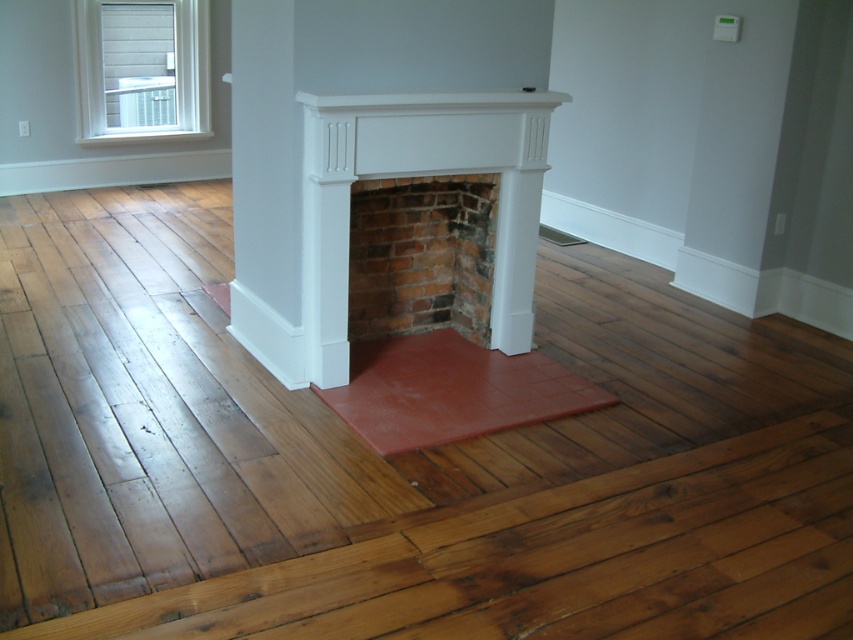
Is white painted brick fireplace at center shorter than brick at center?

No, white painted brick fireplace at center is not shorter than brick at center.

Locate an element on the screen. This screenshot has width=853, height=640. white painted brick fireplace at center is located at coordinates (419, 176).

Can you confirm if shiny brown hardwood floor at center is wider than white matte fireplace mantel at upper center?

Yes, shiny brown hardwood floor at center is wider than white matte fireplace mantel at upper center.

Between point (552, 282) and point (526, 90), which one is positioned in front?

Positioned in front is point (526, 90).

Who is more distant from viewer, (140, 358) or (314, 96)?

The point (140, 358) is behind.

Identify the location of shiny brown hardwood floor at center. (398, 460).

Can you confirm if white painted brick fireplace at center is wider than white wood window at upper left?

Indeed, white painted brick fireplace at center has a greater width compared to white wood window at upper left.

Can you confirm if white painted brick fireplace at center is positioned above white wood window at upper left?

No, white painted brick fireplace at center is not above white wood window at upper left.

Is point (506, 324) closer to camera compared to point (206, 28)?

Yes, point (506, 324) is closer to viewer.

This screenshot has width=853, height=640. In order to click on white painted brick fireplace at center in this screenshot , I will do 419,176.